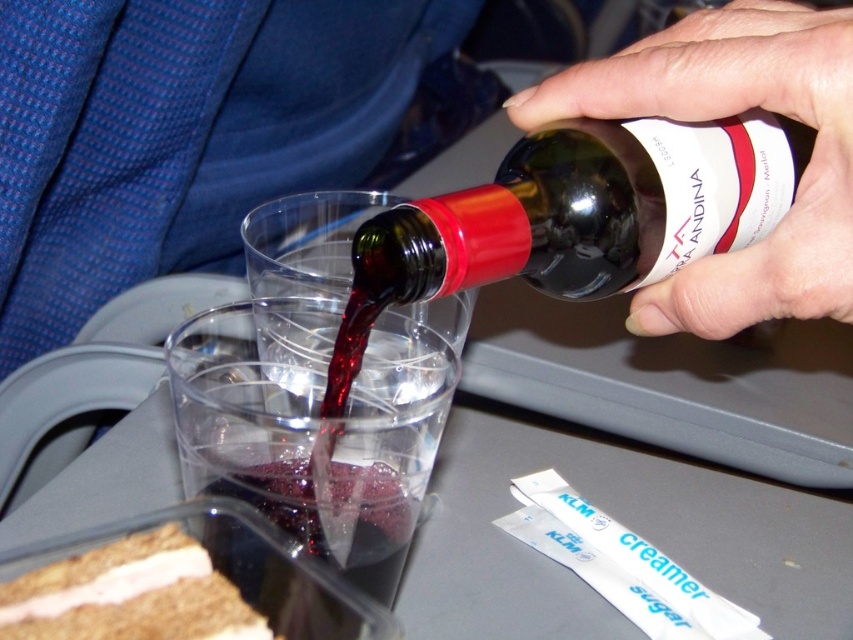
You are a flight attendant on an airplane. You have a dark glass bottle at upper center and a brown crumbly cake at lower left on a tray. Can you tell me which item is taller?

The dark glass bottle at upper center is taller than the brown crumbly cake at lower left according to the description.

You are a flight attendant on an airplane. You need to pour wine into a cup located at point (590, 209). Is the dark glass bottle at upper center positioned correctly to pour into the cup?

The dark glass bottle at upper center is located at point (590, 209), so yes, the bottle is positioned correctly to pour into the cup at that location.

You are a flight attendant on an airplane. You need to pour red wine from the dark glass bottle at upper center into a cup that is 8 inches wide. Will the cup be large enough to hold the bottle?

The dark glass bottle at upper center and the cup are 8.65 inches apart, so the cup is 8 inches wide, which is smaller than the distance between them. Therefore, the cup may not be wide enough to accommodate the bottle during pouring.